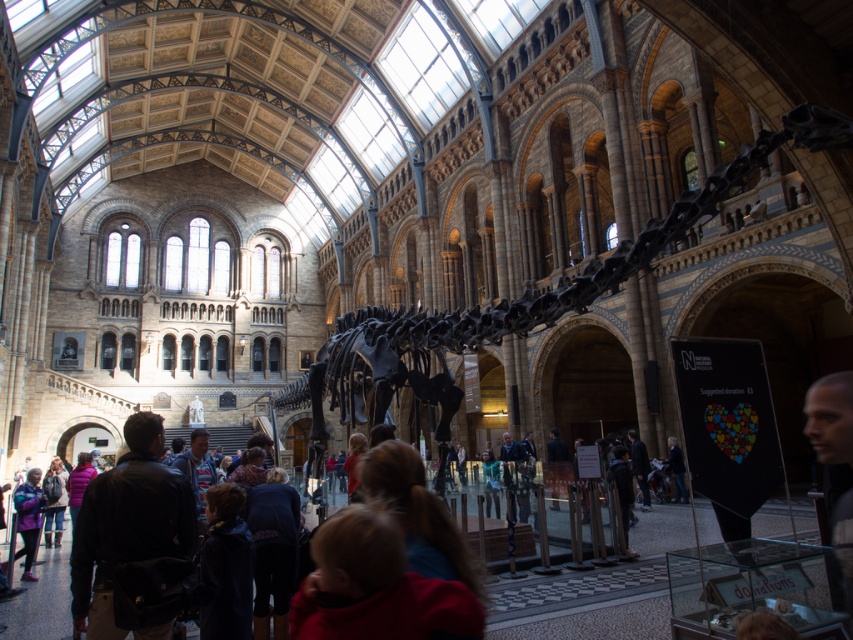
You are a visitor in the museum and see both the red fleece jacket at center and the black leather jacket at center. Which jacket is shorter in height?

The red fleece jacket at center is not as tall as the black leather jacket at center, so the red fleece jacket at center is shorter in height.

You are a visitor in the museum and want to take a photo of the black matte skeleton at center without the matte purple jacket at lower left appearing in the frame. Is it possible to do so by moving to the side?

The black matte skeleton at center might be wider than matte purple jacket at lower left, so it depends on the exact dimensions. If the skeleton is wider, moving to the side may not fully exclude the jacket from the frame. If it is narrower, adjusting your position could help. However, without knowing the exact width difference, it is uncertain.